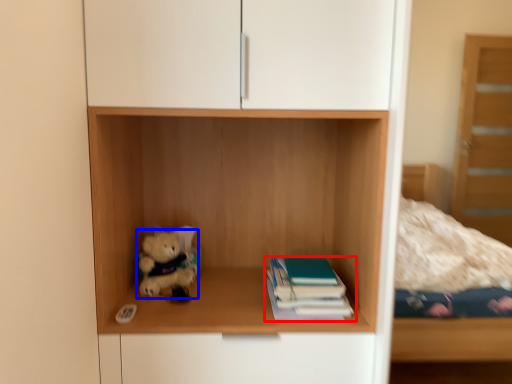
Question: Which point is further to the camera, book (highlighted by a red box) or teddy bear (highlighted by a blue box)?

Choices:
 (A) book
 (B) teddy bear

Answer: (B)